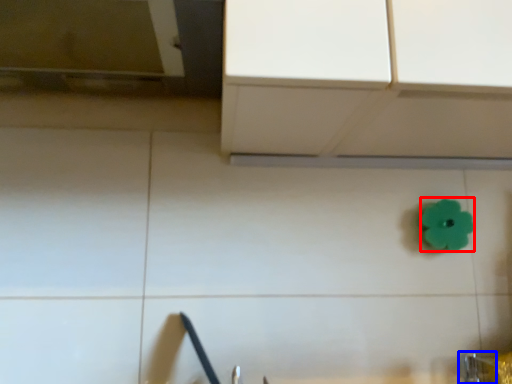
Question: Which of the following is the farthest to the observer, flower (highlighted by a red box) or faucet (highlighted by a blue box)?

Choices:
 (A) flower
 (B) faucet

Answer: (A)